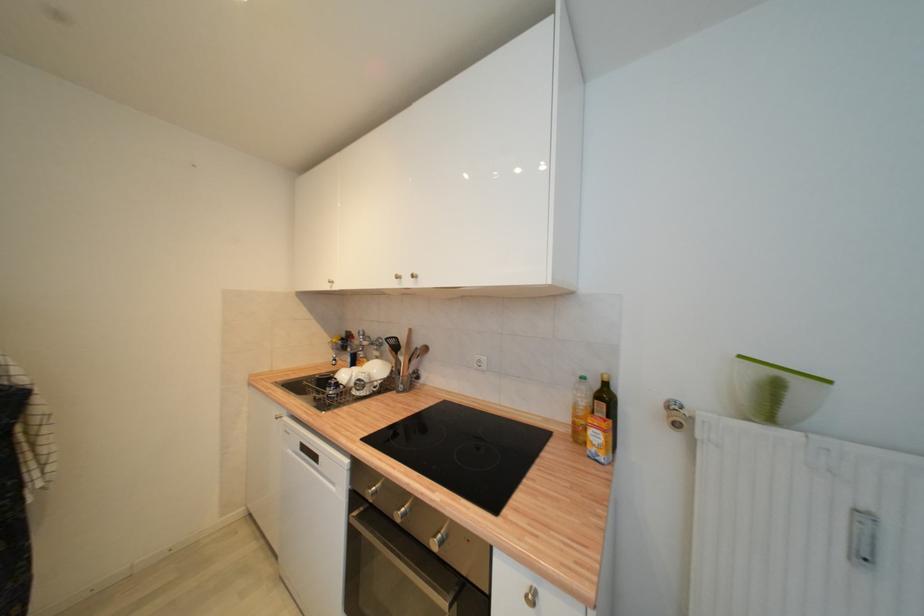
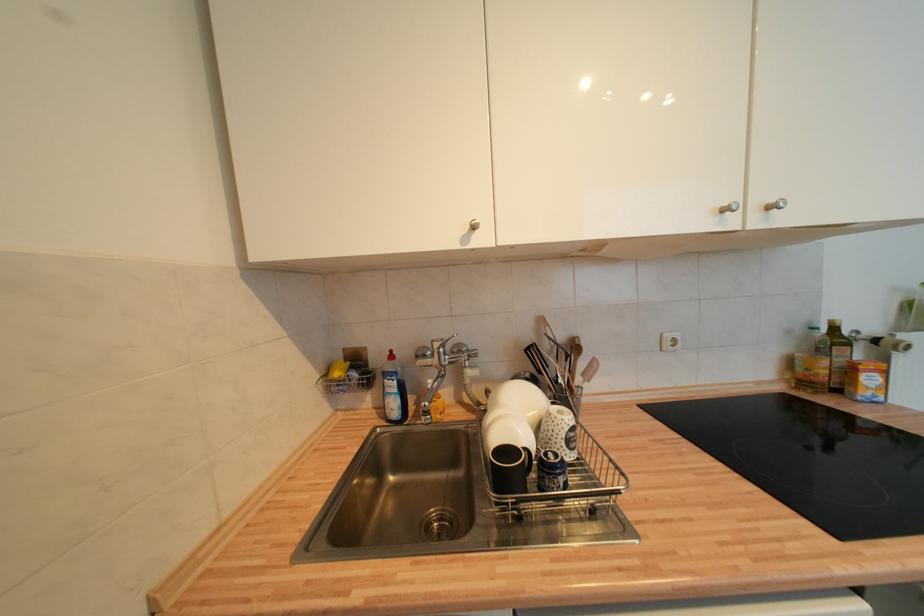
The point at (611, 386) is marked in the first image. Where is the corresponding point in the second image?

(840, 331)